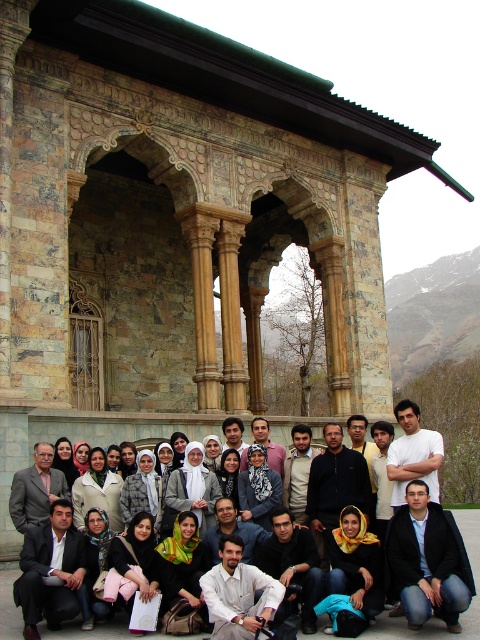
You are a photographer trying to capture the group in the scene. You notice the white cotton shirt at center and the dark blue jeans at lower right. Which clothing item appears taller in the image?

The white cotton shirt at center is taller than the dark blue jeans at lower right.

You are a photographer trying to capture a clear shot of the white cotton shirt at center and the dark blue jeans at lower right. Can you focus on both subjects simultaneously if your camera has a depth of field that only allows focusing on one layer at a time?

The white cotton shirt at center is positioned under the dark blue jeans at lower right, so they are at different depths. Since the camera can only focus on one layer at a time, you cannot focus on both simultaneously.

You are a photographer adjusting your camera settings. You notice the white cotton shirt at center and the dark blue jeans at lower right in your frame. Which object should you focus on first if you want to ensure both are in focus, considering their sizes?

The white cotton shirt at center is bigger than the dark blue jeans at lower right, so focusing on the larger white cotton shirt at center first would help ensure both are in focus since it occupies more space in the frame.